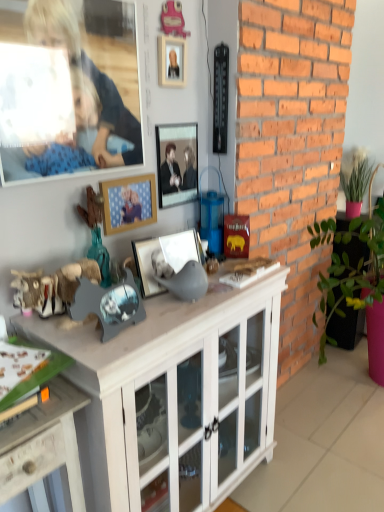
Where is `vacant area located to the right-hand side of matte silver picture frame at center, the 1th picture frame ordered from the bottom`? vacant area located to the right-hand side of matte silver picture frame at center, the 1th picture frame ordered from the bottom is located at coordinates (221, 290).